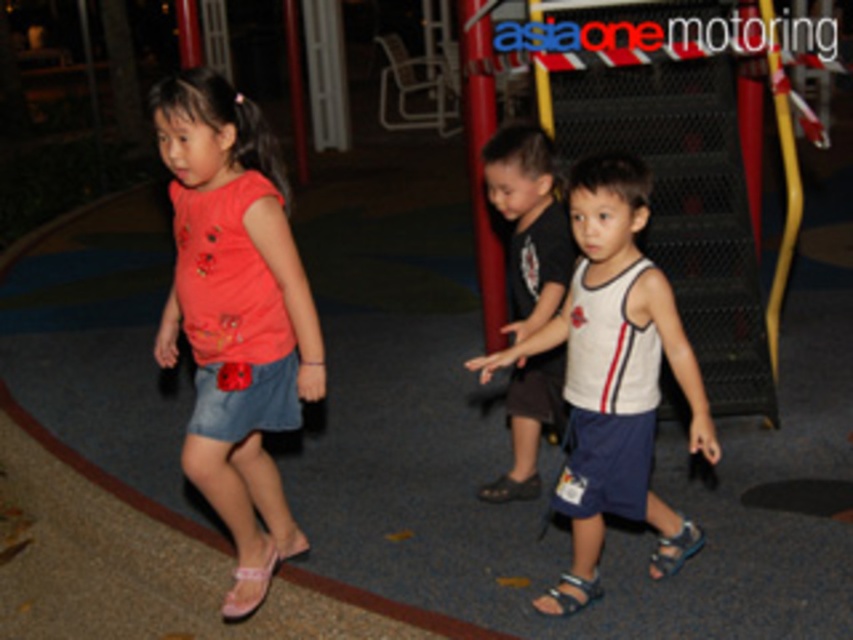
You are a parent supervising the children at the playground. You notice the pink fabric sandal at lower left and the blue fabric sandal at lower center on the ground. Which sandal is positioned further to the left?

The pink fabric sandal at lower left is positioned further to the left compared to the blue fabric sandal at lower center.

You are a parent looking for your child who is wearing a pink fabric sandal at lower left. Based on the scene description, where should you look relative to the girl in the bright red short sleeved shirt?

The pink fabric sandal at lower left is located at point (x=248, y=588), which is to the lower left of the girl in the bright red short sleeved shirt.